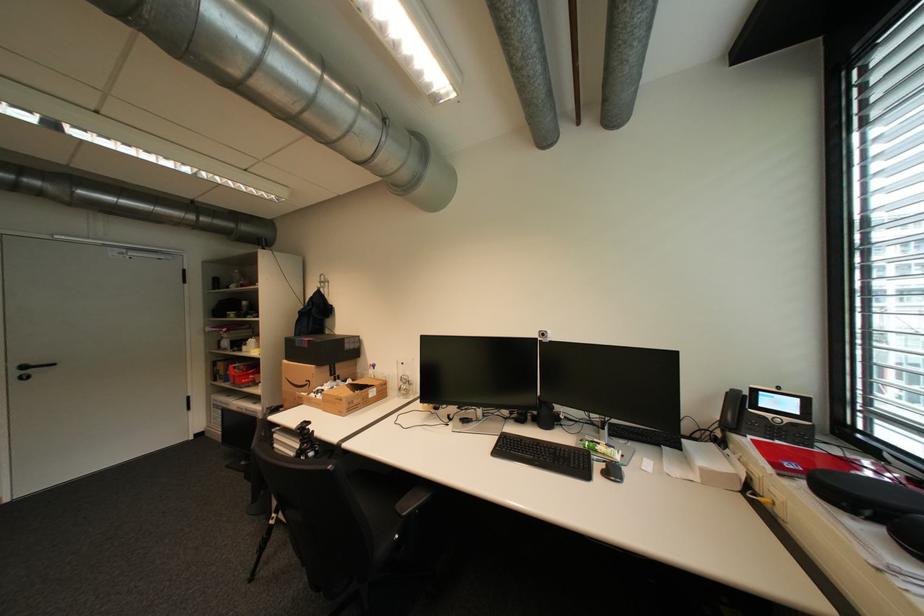
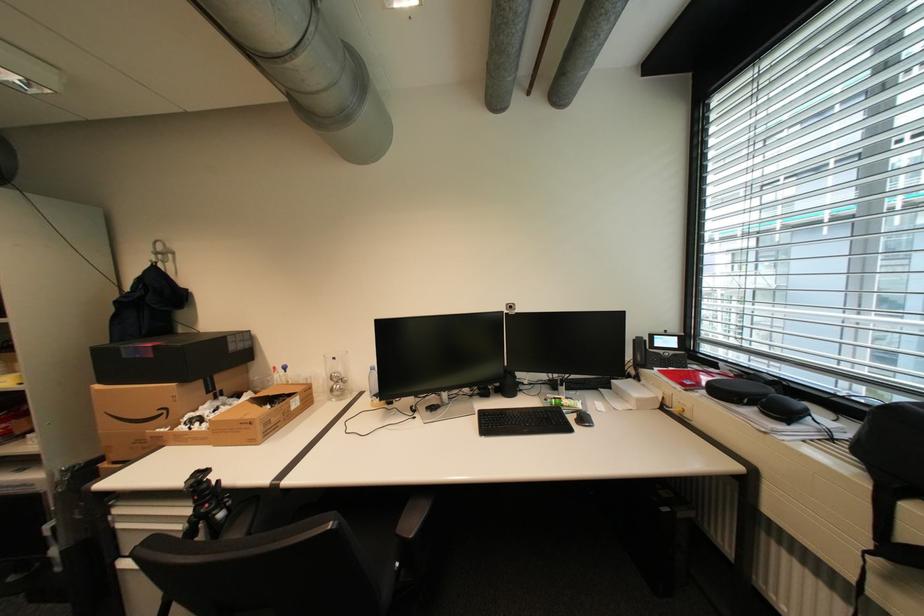
What movement of the cameraman would produce the second image?

The movement direction of the cameraman is left, forward.